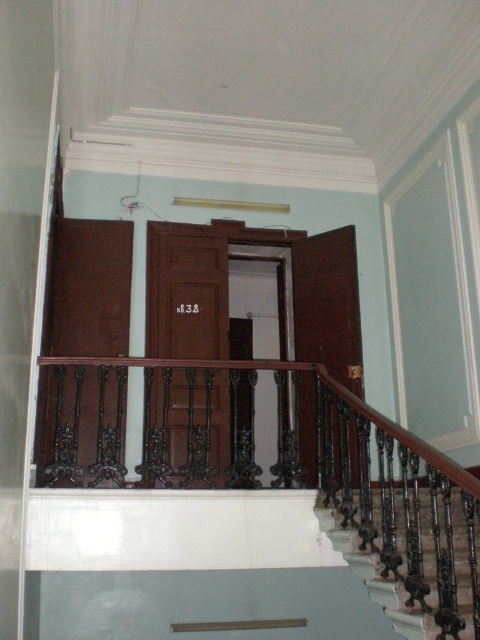
Is black wrought iron railing at center closer to camera compared to dark brown wrought iron at lower right?

Yes, black wrought iron railing at center is in front of dark brown wrought iron at lower right.

I want to click on black wrought iron railing at center, so click(x=291, y=467).

Where is `black wrought iron railing at center`? The height and width of the screenshot is (640, 480). black wrought iron railing at center is located at coordinates (291, 467).